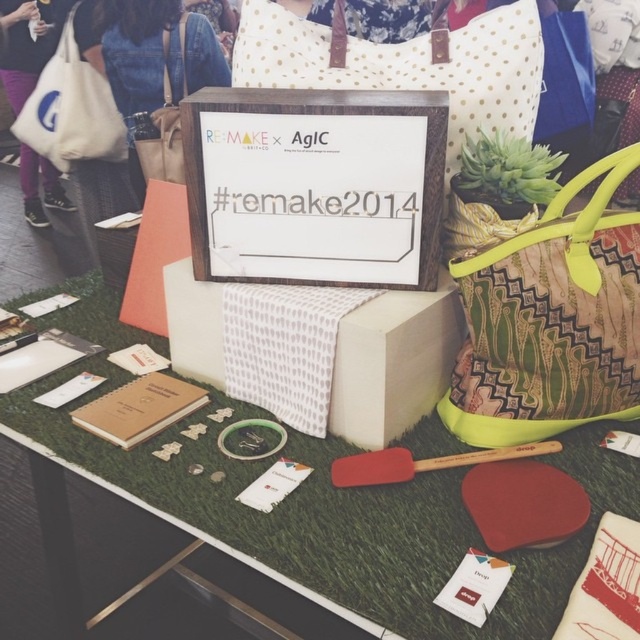
Can you confirm if green patterned fabric bag at center is wider than white dotted pillow at upper center?

In fact, green patterned fabric bag at center might be narrower than white dotted pillow at upper center.

Can you confirm if green patterned fabric bag at center is shorter than white dotted pillow at upper center?

In fact, green patterned fabric bag at center may be taller than white dotted pillow at upper center.

You are a GUI agent. You are given a task and a screenshot of the screen. Output one action in this format:
    pyautogui.click(x=<x>, y=<y>)
    Task: Click on the green patterned fabric bag at center
    This screenshot has height=640, width=640.
    Given the screenshot: What is the action you would take?
    pyautogui.click(x=550, y=321)

Can you confirm if white dotted pillow at upper center is shorter than matte beige tote at upper left?

In fact, white dotted pillow at upper center may be taller than matte beige tote at upper left.

Which is more to the left, white dotted pillow at upper center or matte beige tote at upper left?

Positioned to the left is matte beige tote at upper left.

Locate an element on the screen. white dotted pillow at upper center is located at coordinates (406, 67).

Is white dotted pillow at upper center bigger than white canvas tote at upper left?

Actually, white dotted pillow at upper center might be smaller than white canvas tote at upper left.

Is point (276, 45) positioned behind point (84, 125)?

No, (276, 45) is closer to viewer.

Describe the element at coordinates (406, 67) in the screenshot. I see `white dotted pillow at upper center` at that location.

Locate an element on the screen. The image size is (640, 640). white dotted pillow at upper center is located at coordinates (406, 67).